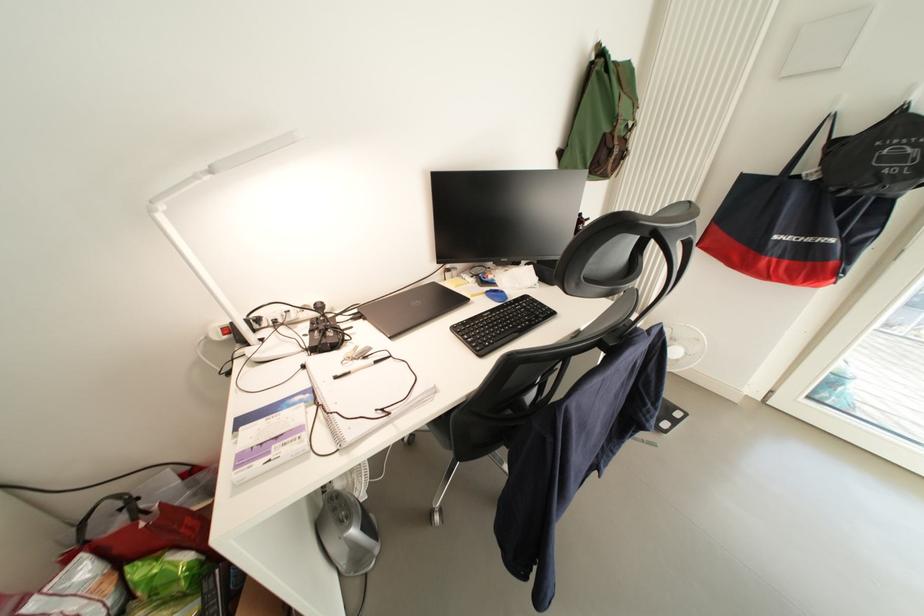
Where would you push the red power switch? Please return your answer as a coordinate pair (x, y).

(224, 331)